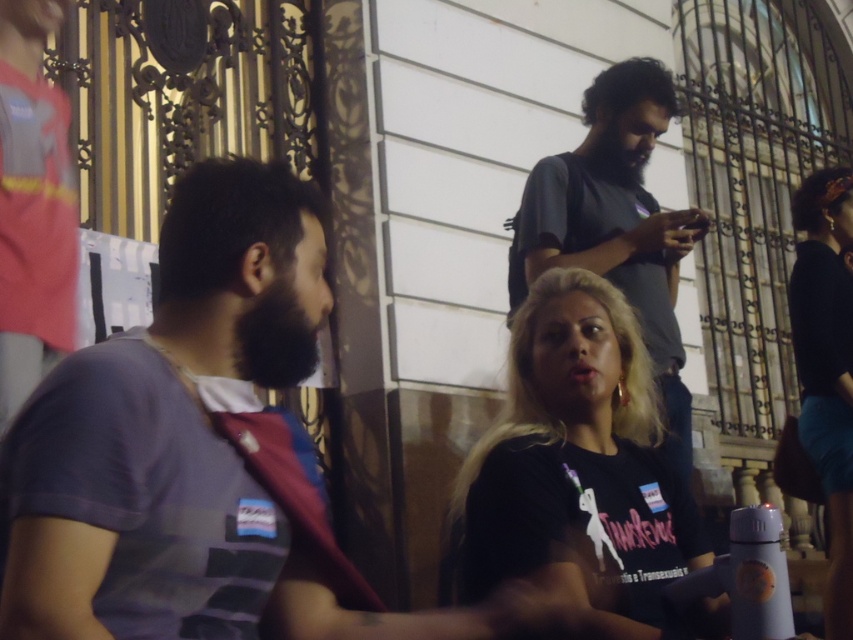
Can you confirm if purple striped shirt at left is shorter than black matte shirt at center?

No.

From the picture: Who is more distant from viewer, (352,579) or (527,385)?

The point (527,385) is more distant.

Locate an element on the screen. purple striped shirt at left is located at coordinates (200, 452).

Does black matte shirt at center have a smaller size compared to black matte shirt at upper right?

Indeed, black matte shirt at center has a smaller size compared to black matte shirt at upper right.

Image resolution: width=853 pixels, height=640 pixels. I want to click on black matte shirt at center, so click(x=579, y=464).

At what (x,y) coordinates should I click in order to perform the action: click on black matte shirt at center. Please return your answer as a coordinate pair (x, y). The image size is (853, 640). Looking at the image, I should click on (579, 464).

Which is more to the right, gray cotton t-shirt at upper center or black matte shirt at upper right?

black matte shirt at upper right is more to the right.

Which is behind, point (643, 156) or point (833, 188)?

The point (833, 188) is more distant.

Where is `gray cotton t-shirt at upper center`? This screenshot has height=640, width=853. gray cotton t-shirt at upper center is located at coordinates (618, 225).